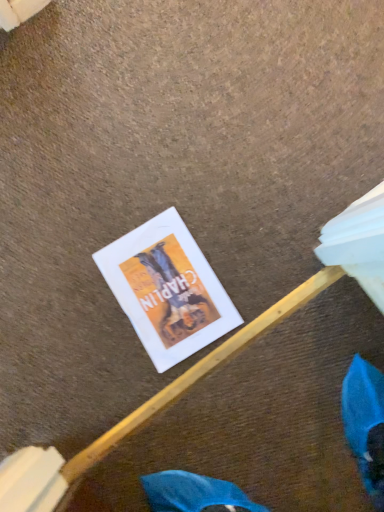
I want to click on vacant region below white paper book at center (from a real-world perspective), so click(166, 288).